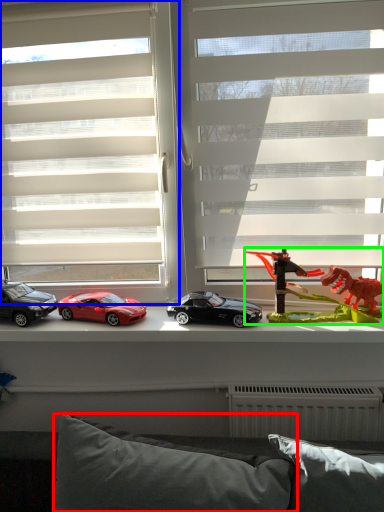
Question: Which is nearer to the pillow (highlighted by a red box)? window (highlighted by a blue box) or toy (highlighted by a green box).

Choices:
 (A) window
 (B) toy

Answer: (B)